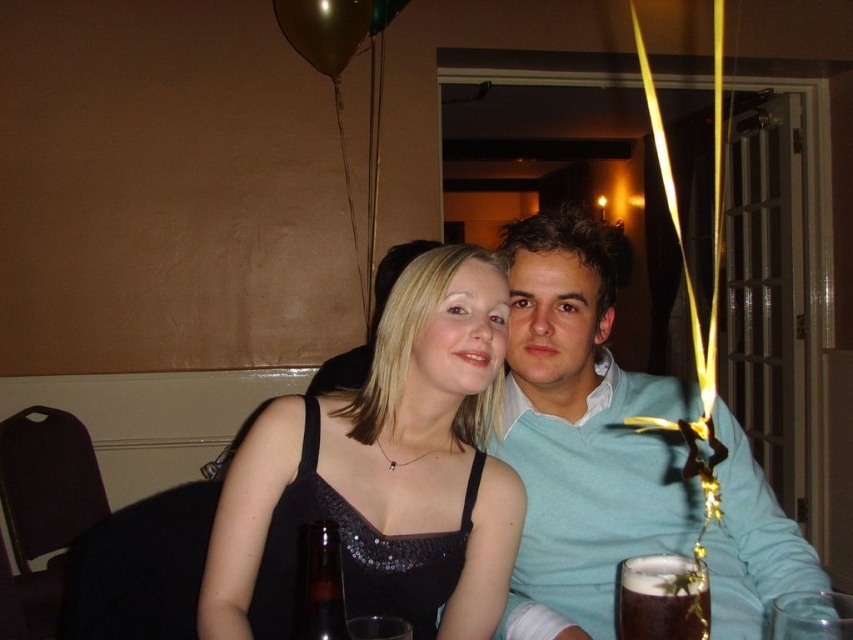
Question: Which object is positioned farthest from the gold metallic balloon at upper center?

Choices:
 (A) light blue sweater at center
 (B) brown glass bottle at lower center
 (C) black satin dress at center

Answer: (B)

Question: Where is black satin dress at center located in relation to gold metallic balloon at upper center in the image?

Choices:
 (A) left
 (B) right

Answer: (B)

Question: Which object is the farthest from the black satin dress at center?

Choices:
 (A) brown glass bottle at lower center
 (B) gold metallic balloon at upper center
 (C) brown frothy beer at lower right

Answer: (B)

Question: Is brown frothy beer at lower right below gold metallic balloon at upper center?

Choices:
 (A) yes
 (B) no

Answer: (A)

Question: Is brown frothy beer at lower right to the right of brown glass bottle at lower center from the viewer's perspective?

Choices:
 (A) no
 (B) yes

Answer: (B)

Question: Which point is farther to the camera?

Choices:
 (A) (788, 538)
 (B) (404, 484)
 (C) (302, 531)

Answer: (A)